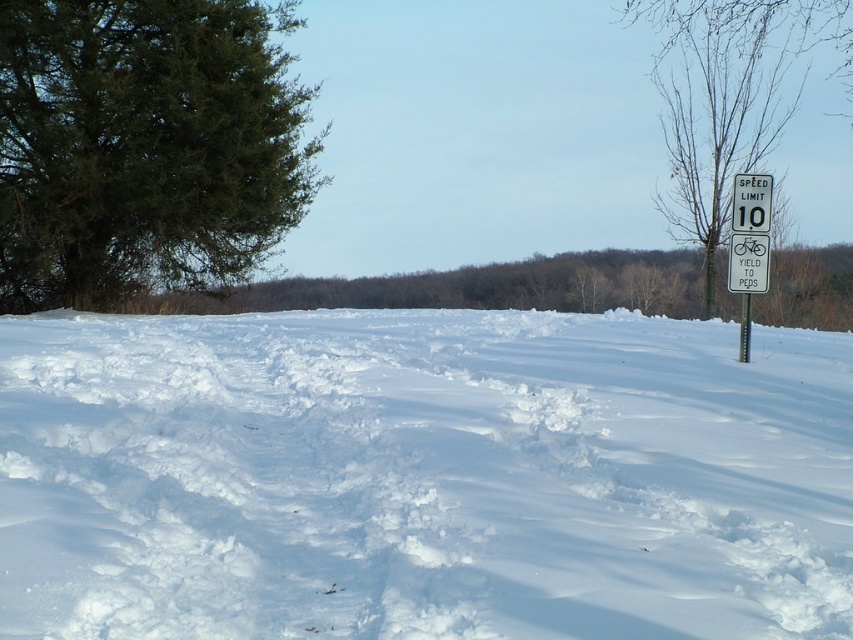
Question: Which object appears closest to the camera in this image?

Choices:
 (A) bare wood tree at right
 (B) white plastic speed limit sign at upper right
 (C) white fluffy snow at center
 (D) green textured evergreen tree at left

Answer: (C)

Question: Can you confirm if green textured evergreen tree at left is positioned below metallic silver pole at right?

Choices:
 (A) yes
 (B) no

Answer: (B)

Question: Does white plastic speed limit sign at upper right have a greater width compared to metallic silver pole at right?

Choices:
 (A) no
 (B) yes

Answer: (B)

Question: Is white fluffy snow at center to the left of white plastic speed limit sign at upper right from the viewer's perspective?

Choices:
 (A) no
 (B) yes

Answer: (B)

Question: Which point is closer to the camera?

Choices:
 (A) [548, 433]
 (B) [210, 266]
 (C) [741, 305]

Answer: (A)

Question: Estimate the real-world distances between objects in this image. Which object is farther from the white plastic speed limit sign at upper right?

Choices:
 (A) green textured evergreen tree at left
 (B) bare wood tree at right
 (C) metallic silver pole at right

Answer: (B)